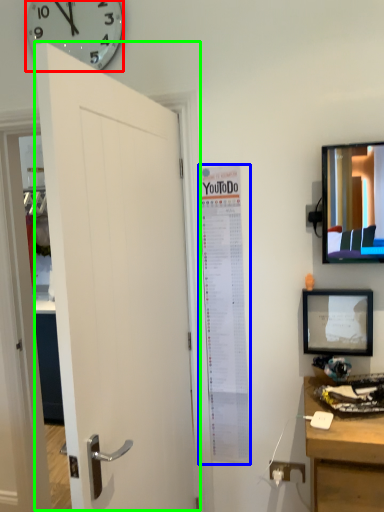
Question: Which object is positioned closest to wall clock (highlighted by a red box)? Select from poster page (highlighted by a blue box) and door (highlighted by a green box).

Choices:
 (A) poster page
 (B) door

Answer: (B)